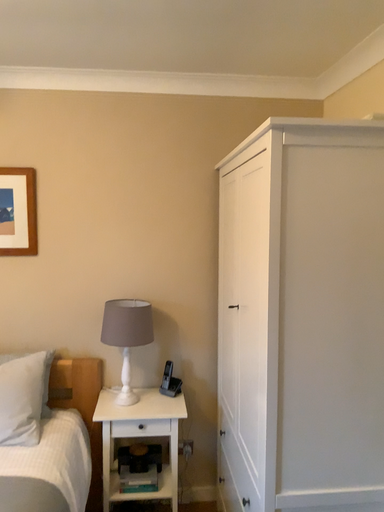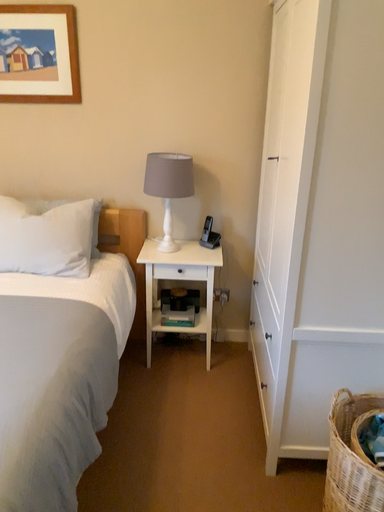
Question: Which way did the camera rotate in the video?

Choices:
 (A) rotated left
 (B) rotated right

Answer: (A)